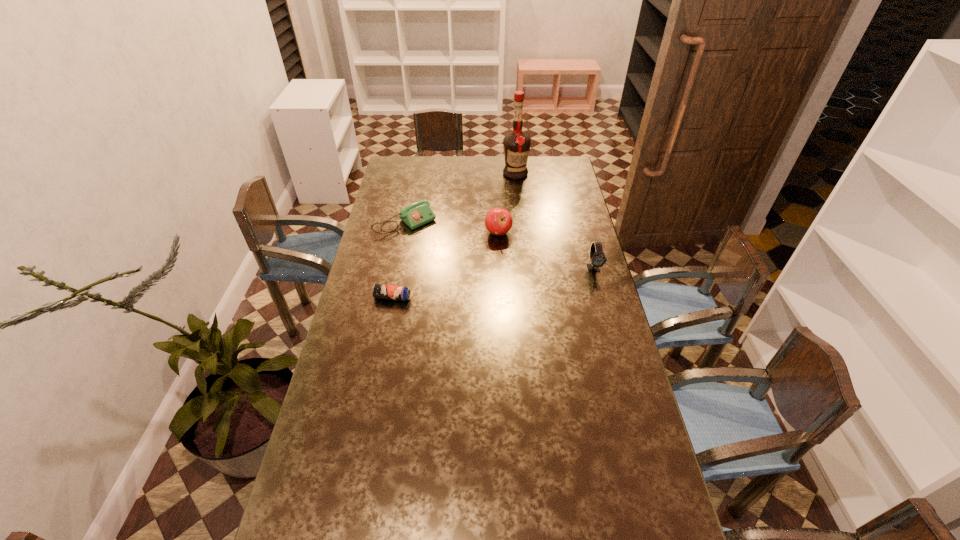
The height and width of the screenshot is (540, 960). Find the location of `the shortest object`. the shortest object is located at coordinates (379, 291).

Image resolution: width=960 pixels, height=540 pixels. In order to click on beer can in this screenshot , I will do `click(379, 291)`.

Where is `watch`? The height and width of the screenshot is (540, 960). watch is located at coordinates (597, 257).

Identify the location of the second nearest object. This screenshot has height=540, width=960. (597, 257).

The image size is (960, 540). Identify the location of apple. (498, 221).

Identify the location of liquor. The width and height of the screenshot is (960, 540). (516, 145).

Find the location of `the farthest object`. the farthest object is located at coordinates (516, 145).

The width and height of the screenshot is (960, 540). I want to click on the second shortest object, so click(x=414, y=215).

Where is `vacant region located 0.200m on the back of the shortest object`? This screenshot has height=540, width=960. vacant region located 0.200m on the back of the shortest object is located at coordinates (400, 255).

Where is `blank space located on the face of the watch`? blank space located on the face of the watch is located at coordinates (612, 336).